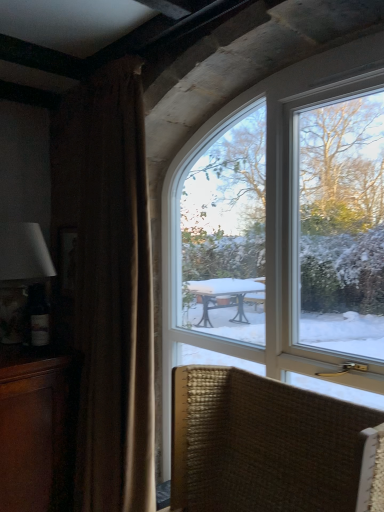
Question: Is woven fabric chair at lower right far away from matte white lampshade at left?

Choices:
 (A) yes
 (B) no

Answer: (A)

Question: Considering the relative sizes of woven fabric chair at lower right and matte white lampshade at left in the image provided, is woven fabric chair at lower right thinner than matte white lampshade at left?

Choices:
 (A) no
 (B) yes

Answer: (A)

Question: Is woven fabric chair at lower right smaller than matte white lampshade at left?

Choices:
 (A) no
 (B) yes

Answer: (A)

Question: Does woven fabric chair at lower right appear on the left side of matte white lampshade at left?

Choices:
 (A) no
 (B) yes

Answer: (A)

Question: Is woven fabric chair at lower right shorter than matte white lampshade at left?

Choices:
 (A) no
 (B) yes

Answer: (B)

Question: Is clear glass window at upper center spatially inside matte white lampshade at left, or outside of it?

Choices:
 (A) outside
 (B) inside

Answer: (A)

Question: Relative to matte white lampshade at left, is clear glass window at upper center in front or behind?

Choices:
 (A) front
 (B) behind

Answer: (A)

Question: Is clear glass window at upper center wider or thinner than matte white lampshade at left?

Choices:
 (A) thin
 (B) wide

Answer: (A)

Question: In terms of height, does clear glass window at upper center look taller or shorter compared to matte white lampshade at left?

Choices:
 (A) short
 (B) tall

Answer: (B)

Question: From the image's perspective, is woven fabric chair at lower right positioned above or below clear glass window at upper center?

Choices:
 (A) below
 (B) above

Answer: (A)

Question: Would you say woven fabric chair at lower right is to the left or to the right of clear glass window at upper center in the picture?

Choices:
 (A) right
 (B) left

Answer: (B)

Question: Is point (327, 398) positioned closer to the camera than point (319, 266)?

Choices:
 (A) closer
 (B) farther

Answer: (A)

Question: From a real-world perspective, is woven fabric chair at lower right physically located above or below clear glass window at upper center?

Choices:
 (A) above
 (B) below

Answer: (B)

Question: From the image's perspective, relative to woven fabric chair at lower right, is wooden cabinet at left above or below?

Choices:
 (A) above
 (B) below

Answer: (B)

Question: From a real-world perspective, is wooden cabinet at left above or below woven fabric chair at lower right?

Choices:
 (A) above
 (B) below

Answer: (B)